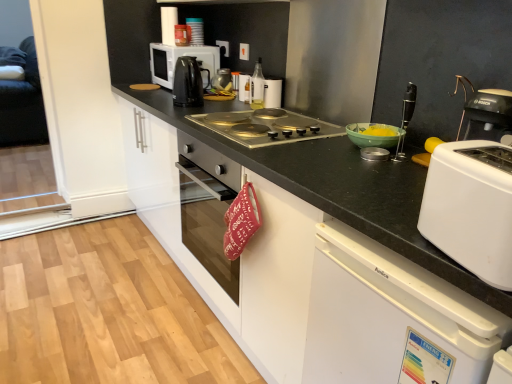
The width and height of the screenshot is (512, 384). I want to click on vacant region to the left of white plastic toaster at right, so click(x=398, y=233).